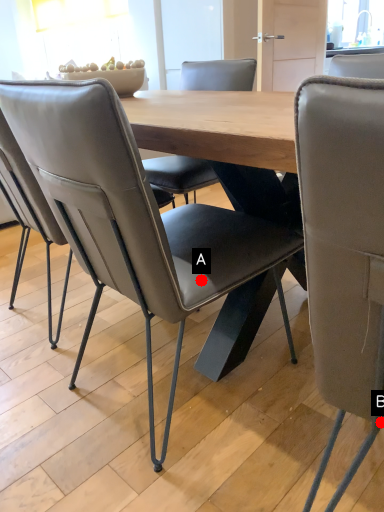
Question: Two points are circled on the image, labeled by A and B beside each circle. Which point appears farthest from the camera in this image?

Choices:
 (A) A is further
 (B) B is further

Answer: (A)